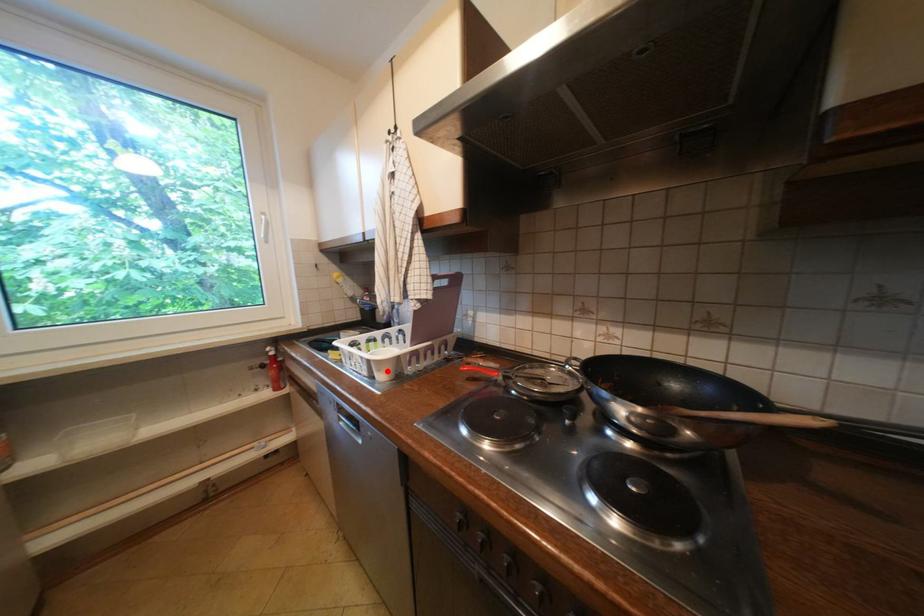
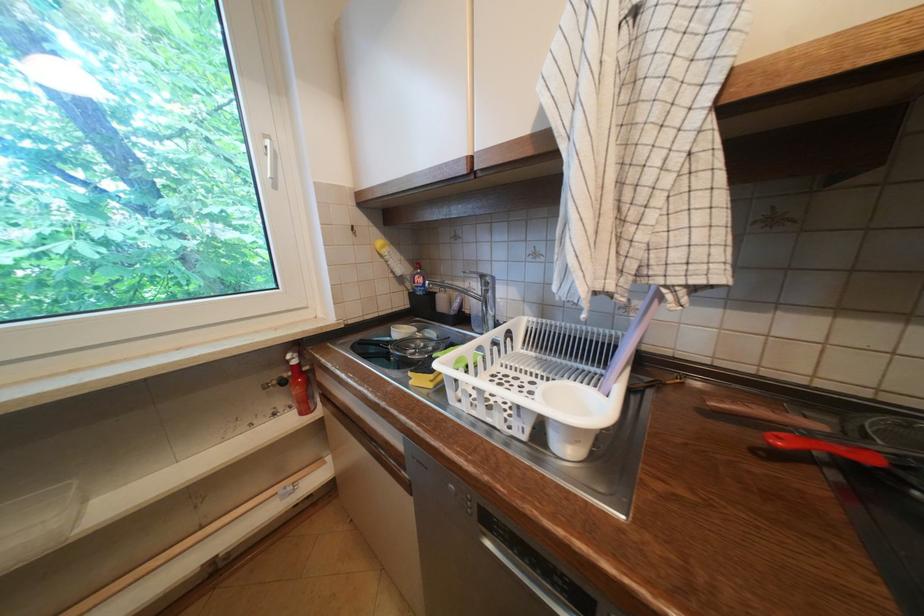
Find the pixel in the second image that matches the highlighted location in the first image.

(586, 443)